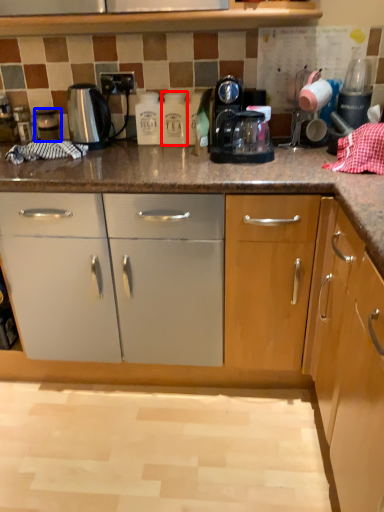
Question: Which object appears farthest to the camera in this image, bottle (highlighted by a red box) or appliance (highlighted by a blue box)?

Choices:
 (A) bottle
 (B) appliance

Answer: (B)